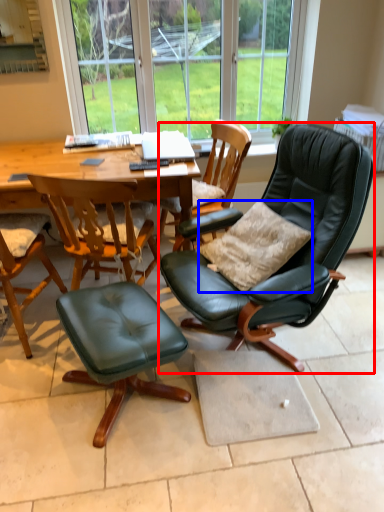
Question: Which object appears farthest to the camera in this image, chair (highlighted by a red box) or pillow (highlighted by a blue box)?

Choices:
 (A) chair
 (B) pillow

Answer: (B)